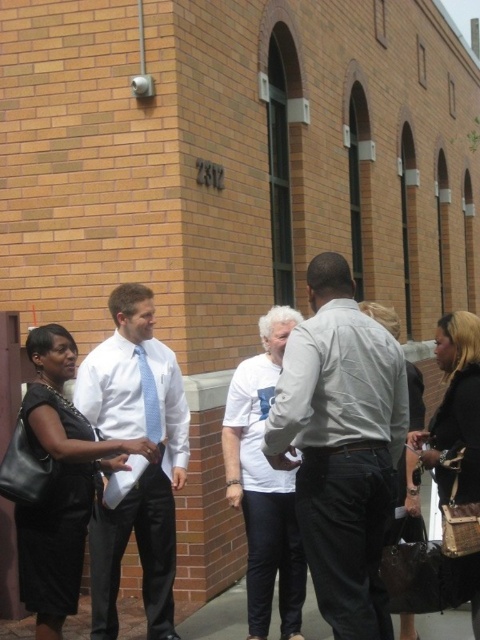
Question: Which of the following is the closest to the observer?

Choices:
 (A) light gray shirt at center
 (B) black leather jacket at lower right
 (C) black leather dress at left
 (D) light blue woven tie at center

Answer: (A)

Question: Based on their relative distances, which object is nearer to the white shirt and tie at center?

Choices:
 (A) black leather jacket at lower right
 (B) matte black purse at center

Answer: (A)

Question: Does black leather dress at left appear under black leather jacket at lower right?

Choices:
 (A) yes
 (B) no

Answer: (A)

Question: Among these points, which one is nearest to the camera?

Choices:
 (A) (261, 612)
 (B) (266, 458)
 (C) (180, 371)
 (D) (28, 528)

Answer: (D)

Question: Does white shirt and tie at center have a smaller size compared to black leather jacket at lower right?

Choices:
 (A) no
 (B) yes

Answer: (A)

Question: Can you confirm if white shirt and tie at center is bigger than light blue woven tie at center?

Choices:
 (A) yes
 (B) no

Answer: (A)